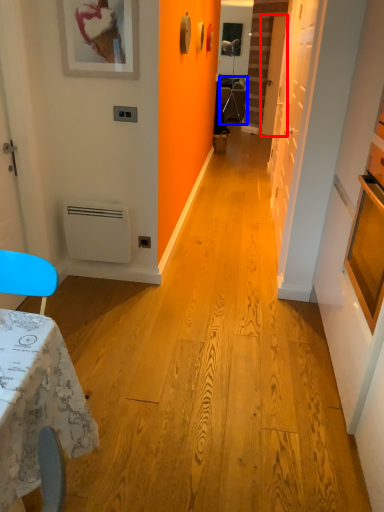
Question: Which object appears closest to the camera in this image, door (highlighted by a red box) or armchair (highlighted by a blue box)?

Choices:
 (A) door
 (B) armchair

Answer: (A)